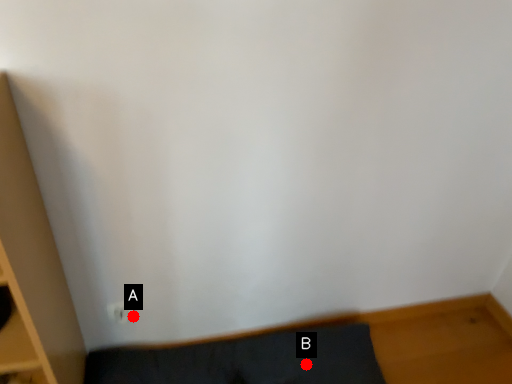
Question: Two points are circled on the image, labeled by A and B beside each circle. Which point is closer to the camera taking this photo?

Choices:
 (A) A is closer
 (B) B is closer

Answer: (B)